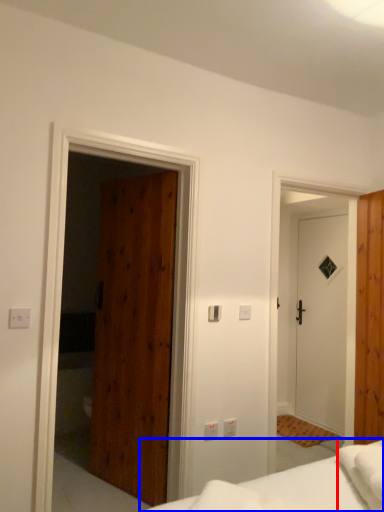
Question: Among these objects, which one is nearest to the camera, sheet (highlighted by a red box) or bed (highlighted by a blue box)?

Choices:
 (A) sheet
 (B) bed

Answer: (B)